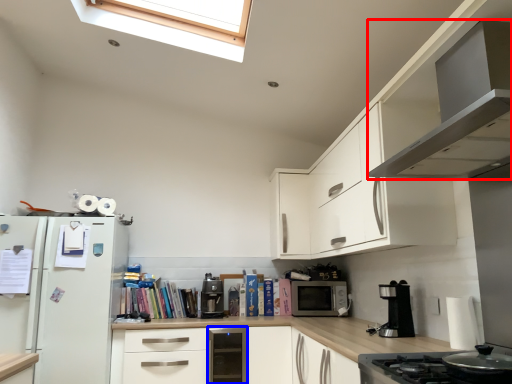
Question: Which point is further to the camera, home appliance (highlighted by a red box) or dish washer (highlighted by a blue box)?

Choices:
 (A) home appliance
 (B) dish washer

Answer: (B)